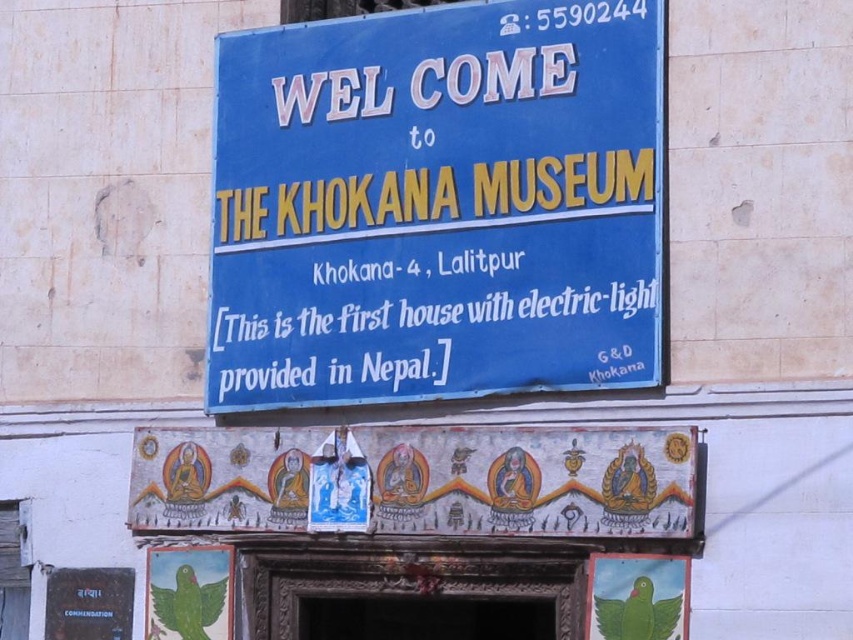
Which is below, blue plastic sign at upper center or painted wood banner at center?

Positioned lower is painted wood banner at center.

Can you confirm if blue plastic sign at upper center is shorter than painted wood banner at center?

No, blue plastic sign at upper center is not shorter than painted wood banner at center.

Does point (514, 348) come in front of point (636, 444)?

No, it is not.

This screenshot has width=853, height=640. I want to click on blue plastic sign at upper center, so click(437, 205).